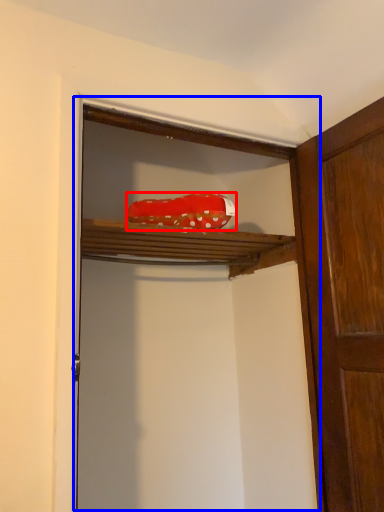
Question: Which of the following is the closest to the observer, material (highlighted by a red box) or cabinetry (highlighted by a blue box)?

Choices:
 (A) material
 (B) cabinetry

Answer: (B)